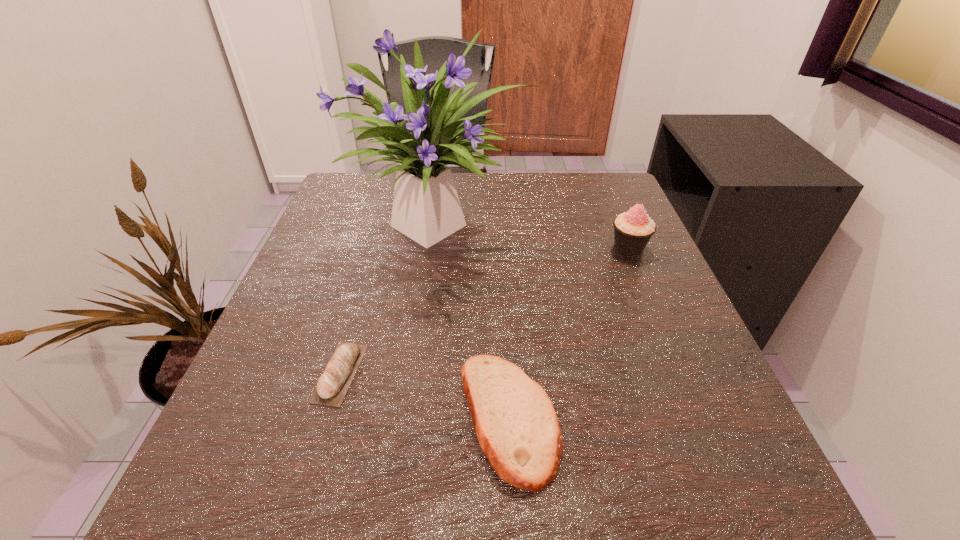
This screenshot has width=960, height=540. What are the coordinates of `vacant area that lies between the left pita bread and the third tallest object` in the screenshot? It's located at (424, 396).

Where is `free spot between the left pita bread and the third tallest object`? The image size is (960, 540). free spot between the left pita bread and the third tallest object is located at coordinates (424, 396).

Find the location of a particular element. The width and height of the screenshot is (960, 540). free space that is in between the third tallest object and the shortest object is located at coordinates (424, 396).

Choose which object is the second nearest neighbor to the tallest object. Please provide its 2D coordinates. Your answer should be formatted as a tuple, i.e. [(x, y)], where the tuple contains the x and y coordinates of a point satisfying the conditions above.

[(332, 386)]

Identify which object is the second nearest to the rightmost object. Please provide its 2D coordinates. Your answer should be formatted as a tuple, i.e. [(x, y)], where the tuple contains the x and y coordinates of a point satisfying the conditions above.

[(518, 430)]

This screenshot has height=540, width=960. I want to click on vacant space that satisfies the following two spatial constraints: 1. on the front side of the third tallest object; 2. on the right side of the flower arrangement, so click(415, 418).

Find the location of a particular element. The height and width of the screenshot is (540, 960). free space that satisfies the following two spatial constraints: 1. on the back side of the flower arrangement; 2. on the right side of the shortest object is located at coordinates (384, 222).